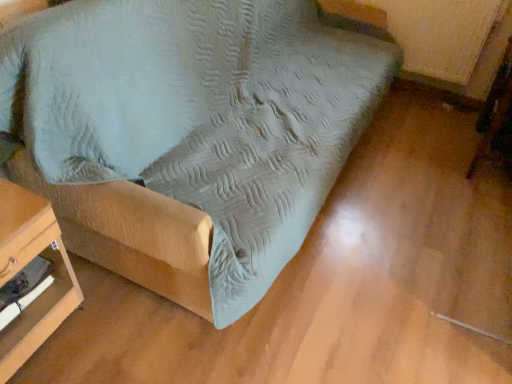
Question: From the image's perspective, is wooden table at lower left, the 2th furniture when ordered from right to left, located above or below wooden swivel chair at lower right?

Choices:
 (A) above
 (B) below

Answer: (B)

Question: Considering the positions of wooden table at lower left, the 2th furniture when ordered from right to left, and wooden swivel chair at lower right in the image, is wooden table at lower left, the 2th furniture when ordered from right to left, wider or thinner than wooden swivel chair at lower right?

Choices:
 (A) wide
 (B) thin

Answer: (A)

Question: Estimate the real-world distances between objects in this image. Which object is closer to the wooden table at lower left, which ranks as the first furniture in left-to-right order?

Choices:
 (A) wooden swivel chair at lower right
 (B) suede-like fabric couch at center, the 2th furniture when ordered from left to right

Answer: (B)

Question: Which is farther from the suede-like fabric couch at center, placed as the 1th furniture when sorted from right to left?

Choices:
 (A) wooden table at lower left, which ranks as the first furniture in left-to-right order
 (B) wooden swivel chair at lower right

Answer: (B)